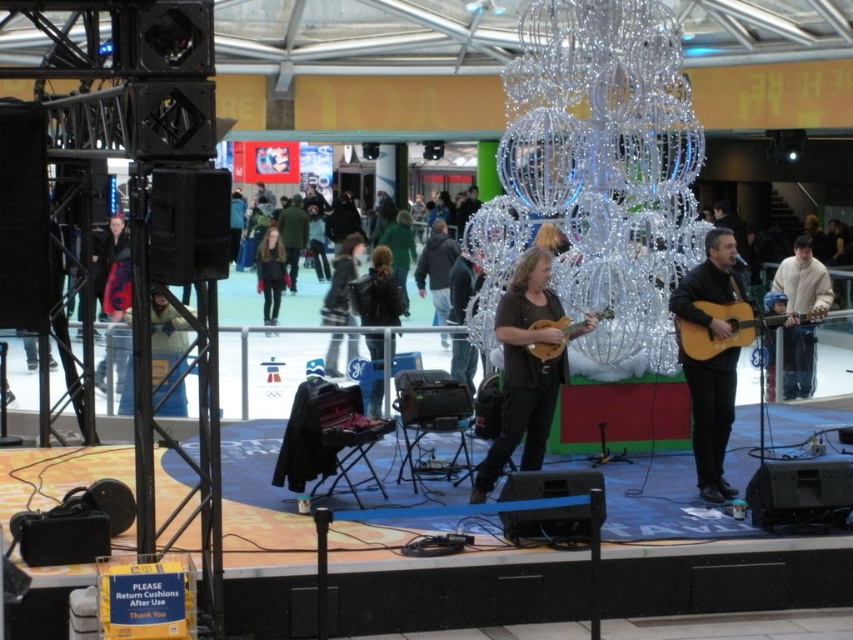
Question: Among these points, which one is nearest to the camera?

Choices:
 (A) (757, 330)
 (B) (544, 320)

Answer: (B)

Question: Can you confirm if wooden acoustic guitar at right is wider than wooden acoustic guitar at center?

Choices:
 (A) yes
 (B) no

Answer: (A)

Question: Is white woolen sweater at right wider than wooden acoustic guitar at center?

Choices:
 (A) no
 (B) yes

Answer: (A)

Question: In this image, where is black leather jacket at center located relative to dark brown leather jacket at center?

Choices:
 (A) below
 (B) above

Answer: (A)

Question: Which object is the closest to the wooden acoustic guitar at center?

Choices:
 (A) dark brown leather jacket at center
 (B) black leather jacket at center
 (C) wooden acoustic guitar at right

Answer: (C)

Question: Which object appears closest to the camera in this image?

Choices:
 (A) brown matte mandolin at center
 (B) wooden acoustic guitar at right
 (C) black leather jacket at center

Answer: (A)